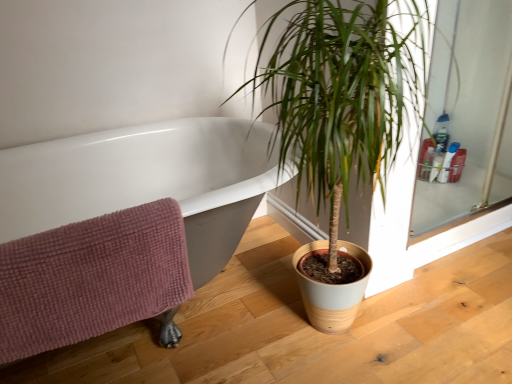
Question: In the image, is translucent plastic bottle at upper right, which is counted as the first toiletry, starting from the right, on the left side or the right side of green leafy plant at center?

Choices:
 (A) right
 (B) left

Answer: (A)

Question: Considering the positions of point (455, 152) and point (353, 291), is point (455, 152) closer or farther from the camera than point (353, 291)?

Choices:
 (A) farther
 (B) closer

Answer: (A)

Question: Based on their relative distances, which object is farther from the green leafy plant at center?

Choices:
 (A) translucent plastic bottles at upper right, arranged as the 1th toiletry when viewed from the left
 (B) white glossy bathtub at upper left
 (C) translucent plastic bottles at upper right, the 2th toiletry in the right-to-left sequence
 (D) translucent plastic bottle at upper right, which ranks as the 3th toiletry in left-to-right order
 (E) pink waffle-textured towel at lower left

Answer: (D)

Question: Estimate the real-world distances between objects in this image. Which object is closer to the green leafy plant at center?

Choices:
 (A) translucent plastic bottles at upper right, arranged as the 1th toiletry when viewed from the left
 (B) pink waffle-textured towel at lower left
 (C) translucent plastic bottle at upper right, which is counted as the first toiletry, starting from the right
 (D) translucent plastic bottles at upper right, the 2th toiletry in the right-to-left sequence
 (E) white glossy bathtub at upper left

Answer: (E)